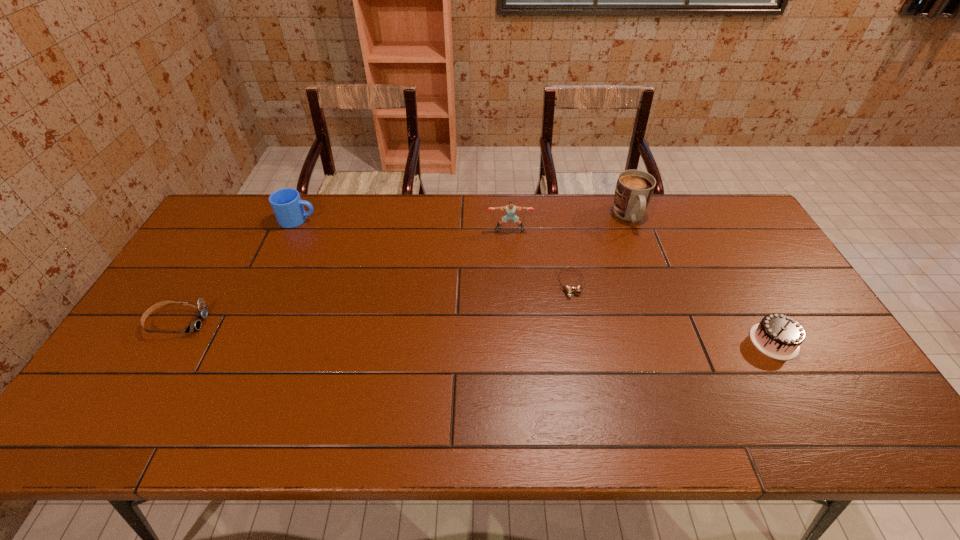
The image size is (960, 540). I want to click on vacant region between the fifth object from right to left and the rightmost object, so click(536, 280).

This screenshot has width=960, height=540. Find the location of `empty location between the fifth object from left to right and the leftmost object`. empty location between the fifth object from left to right and the leftmost object is located at coordinates (403, 269).

Locate an element on the screen. empty space that is in between the fifth tallest object and the shorter mug is located at coordinates (237, 271).

Where is `object identified as the fourth closest to the puncher`? This screenshot has width=960, height=540. object identified as the fourth closest to the puncher is located at coordinates (779, 336).

Locate an element on the screen. the third closest object to the chocolate cake is located at coordinates (510, 209).

Where is `free spot that satisfies the following two spatial constraints: 1. on the front lenses and sides of the third nearest object; 2. on the left side of the rightmost object`? This screenshot has height=540, width=960. free spot that satisfies the following two spatial constraints: 1. on the front lenses and sides of the third nearest object; 2. on the left side of the rightmost object is located at coordinates (582, 341).

Image resolution: width=960 pixels, height=540 pixels. I want to click on vacant space that satisfies the following two spatial constraints: 1. on the front-facing side of the taller goggles; 2. on the right side of the chocolate cake, so click(165, 341).

Locate an element on the screen. Image resolution: width=960 pixels, height=540 pixels. vacant position in the image that satisfies the following two spatial constraints: 1. on the front-facing side of the leftmost object; 2. on the left side of the rightmost object is located at coordinates (165, 341).

Find the location of a particular element. This screenshot has height=540, width=960. free space that satisfies the following two spatial constraints: 1. on the front lenses and sides of the rightmost object; 2. on the right side of the shorter goggles is located at coordinates pyautogui.click(x=582, y=341).

At what (x,y) coordinates should I click in order to perform the action: click on vacant space that satisfies the following two spatial constraints: 1. on the front lenses and sides of the third nearest object; 2. on the left side of the chocolate cake. Please return your answer as a coordinate pair (x, y). This screenshot has width=960, height=540. Looking at the image, I should click on pyautogui.click(x=582, y=341).